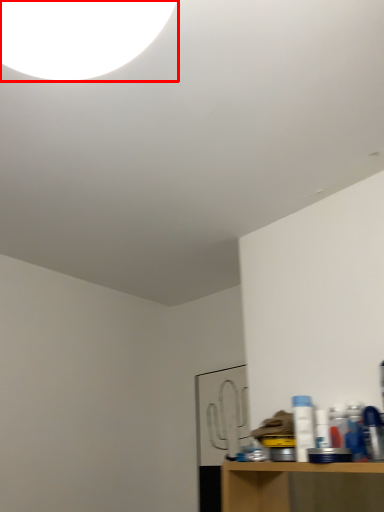
Question: From the image's perspective, where is light (annotated by the red box) located in relation to bottle in the image?

Choices:
 (A) below
 (B) above

Answer: (B)